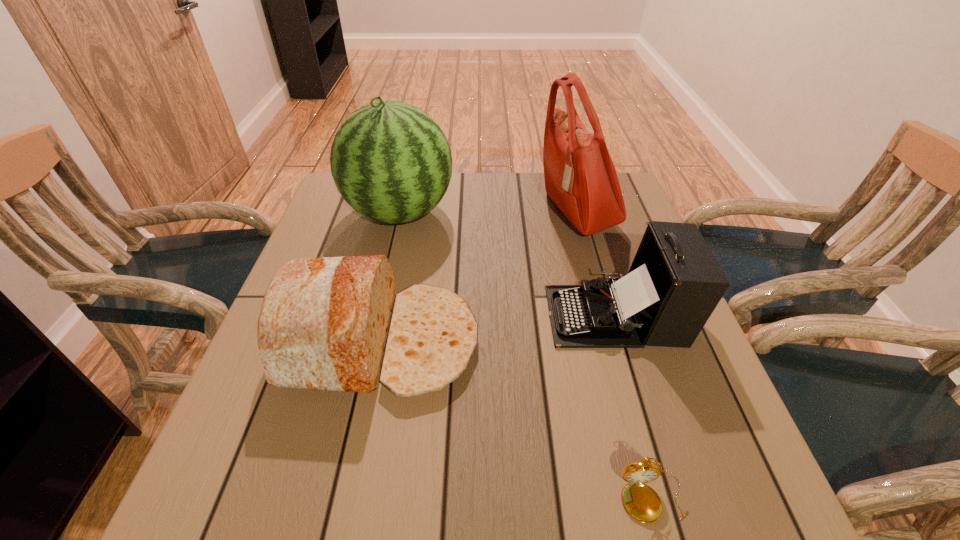
What are the coordinates of `free space at the near right corner of the desktop` in the screenshot? It's located at (700, 473).

Where is `free space between the typewriter and the watermelon`? The height and width of the screenshot is (540, 960). free space between the typewriter and the watermelon is located at coordinates (508, 265).

In order to click on free space between the nearest object and the typewriter in this screenshot , I will do `click(634, 406)`.

This screenshot has height=540, width=960. I want to click on free space between the shortest object and the typewriter, so click(634, 406).

Where is `free spot between the handbag and the watermelon`? free spot between the handbag and the watermelon is located at coordinates (489, 213).

You are a GUI agent. You are given a task and a screenshot of the screen. Output one action in this format:
    pyautogui.click(x=<x>, y=<y>)
    Task: Click on the blank region between the bread and the typewriter
    
    Given the screenshot: What is the action you would take?
    pyautogui.click(x=498, y=329)

You are a GUI agent. You are given a task and a screenshot of the screen. Output one action in this format:
    pyautogui.click(x=<x>, y=<y>)
    Task: Click on the free space between the watermelon and the pocket watch
    Image resolution: width=960 pixels, height=540 pixels.
    Given the screenshot: What is the action you would take?
    pyautogui.click(x=526, y=355)

The height and width of the screenshot is (540, 960). What are the coordinates of `vacant point located between the shortest object and the typewriter` in the screenshot? It's located at (634, 406).

This screenshot has width=960, height=540. Identify the location of vacant area that lies between the nearest object and the typewriter. (634, 406).

Where is `vacant area between the typewriter and the bread`? The image size is (960, 540). vacant area between the typewriter and the bread is located at coordinates pos(498,329).